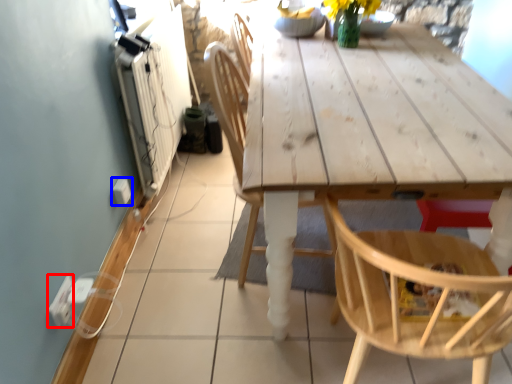
Question: Which point is further to the camera, electric outlet (highlighted by a red box) or electric outlet (highlighted by a blue box)?

Choices:
 (A) electric outlet
 (B) electric outlet

Answer: (B)